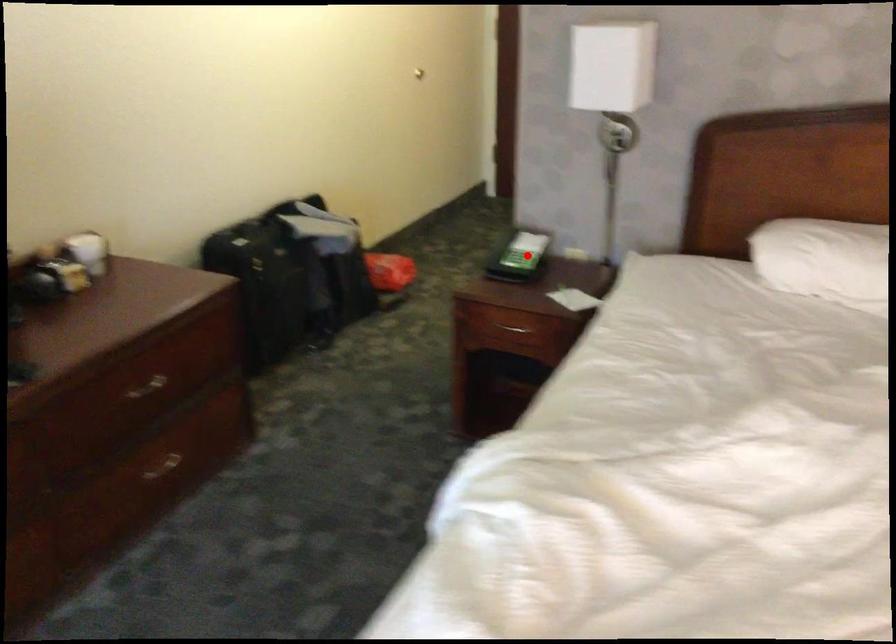
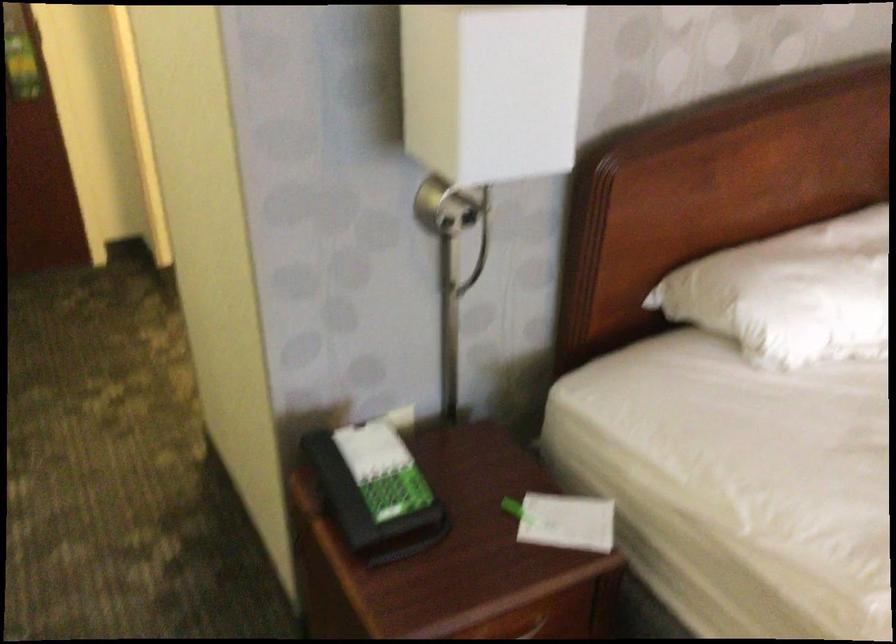
Where in the second image is the point corresponding to the highlighted location from the first image?

(375, 491)